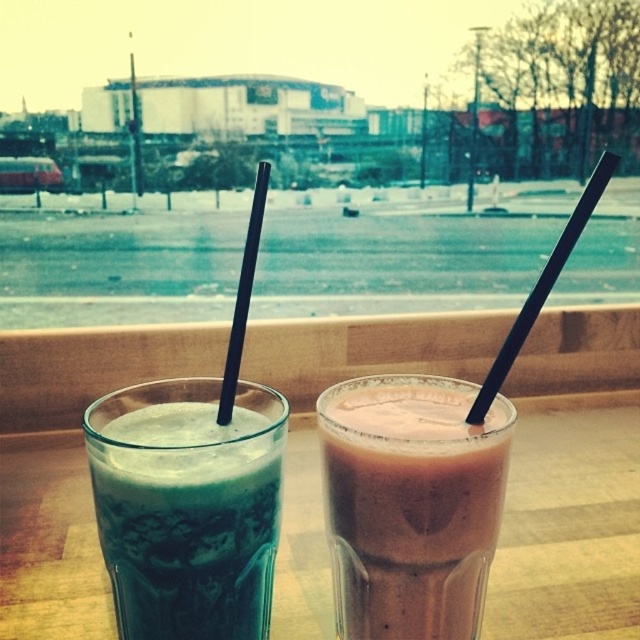
You are at a cafe and want to choose the larger item between the green frosted glass at left and the black matte straw at right. Which one should you pick?

The green frosted glass at left is larger than the black matte straw at right, so you should pick the green frosted glass at left.

You are holding a smartphone camera and want to take a photo of the point at coordinate [138,406] in the scene. The camera is currently 9.95 inches away from that point. If you move the camera 3 inches closer, will the point become larger in the photo?

Moving the camera 3 inches closer to the point at coordinate [138,406] would reduce the distance from 9.95 inches to 6.95 inches. Since objects appear larger in photos when the camera is closer, the point will indeed become larger in the photo.